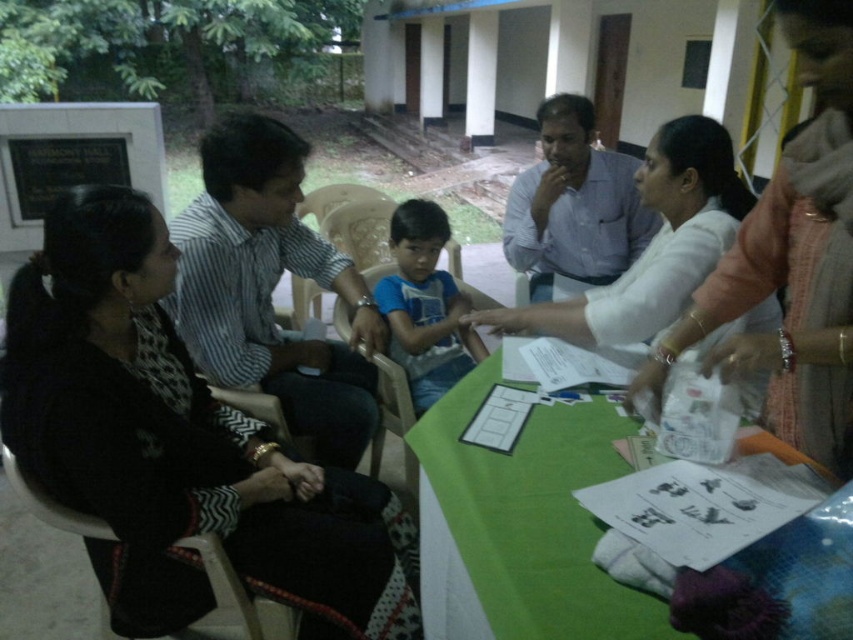
You are a photographer who needs to set up a camera to capture the group around the table. The camera must be placed at least 5 feet away from the white cloth at center to avoid obstruction. Can you position the camera in this setup?

The white cloth at center and camera are 5.11 feet apart from each other, so yes, the camera can be positioned at the required distance since 5.11 feet is more than 5 feet.

You are a photographer trying to capture a candid shot of the group around the table. You need to position yourself so that the green fabric table at lower center is visible but the black fabric chair at lower left is not in the frame. Is this possible based on their positions?

The green fabric table at lower center is behind the black fabric chair at lower left, so if positioned appropriately, the photographer can angle the shot to show the table while blocking the chair with the table itself.

You are a photographer at the event and need to position yourself so that both the black fabric dress at left and the white cloth at center are visible in your shot. Based on their positions, which object should you place closer to the left side of your camera frame?

The black fabric dress at left should be placed closer to the left side of your camera frame since it is positioned to the left of the white cloth at center.